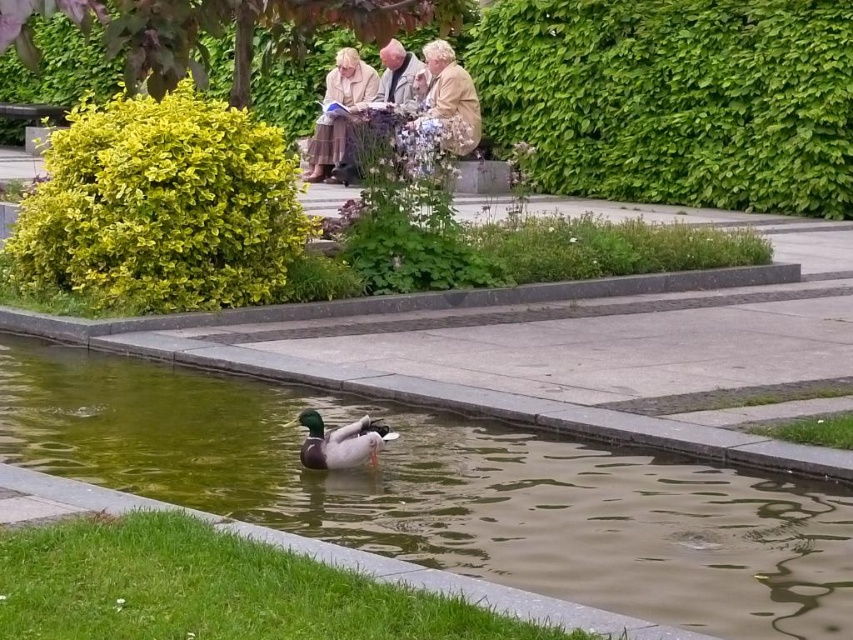
You are a park visitor who wants to place a small floating toy boat in the water near the duck. The boat requires at least 20 feet of space between it and any objects on the shore to avoid drifting away. Is the distance between the greenish water at duck center and the light beige fabric coat at upper center sufficient for this?

The greenish water at duck center is 36.70 feet from the light beige fabric coat at upper center, which is more than the required 20 feet. Therefore, placing the boat near the duck would be safe as there is enough space between them.

You are standing in the park looking at the pond. There are two points marked on the water surface at coordinates point [434,84] and point [396,84]. Which point is closer to you?

Point [434,84] is closer to the viewer than point [396,84].

You are standing in the park and see the point marked at coordinates [338,113]. According to the scene description, what object is located at that point?

The point at coordinates [338,113] corresponds to the light beige fabric coat at center.